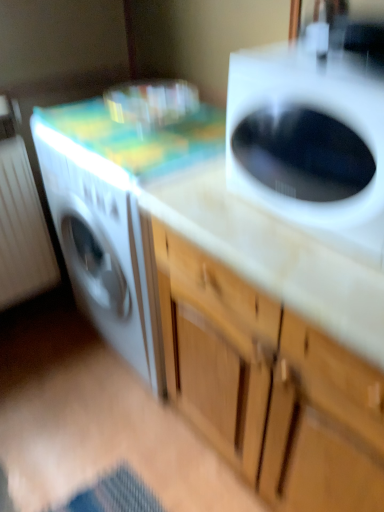
Where is `white glossy washing machine at upper right`? white glossy washing machine at upper right is located at coordinates (310, 141).

Describe the element at coordinates (310, 141) in the screenshot. I see `white glossy washing machine at upper right` at that location.

Measure the distance between point (229, 301) and camera.

Point (229, 301) and camera are 35.51 inches apart from each other.

At what (x,y) coordinates should I click in order to perform the action: click on wooden cabinet at center. Please return your answer as a coordinate pair (x, y). This screenshot has height=512, width=384. Looking at the image, I should click on (269, 386).

The width and height of the screenshot is (384, 512). Describe the element at coordinates (269, 386) in the screenshot. I see `wooden cabinet at center` at that location.

You are a GUI agent. You are given a task and a screenshot of the screen. Output one action in this format:
    pyautogui.click(x=<x>, y=<y>)
    Task: Click on the white glossy washing machine at upper right
    
    Given the screenshot: What is the action you would take?
    pyautogui.click(x=310, y=141)

Which object is positioned more to the right, wooden cabinet at center or white glossy washing machine at upper right?

wooden cabinet at center.

Which object is closer to the camera taking this photo, wooden cabinet at center or white glossy washing machine at upper right?

wooden cabinet at center.

Does point (272, 346) lie in front of point (276, 212)?

That is True.

From the image's perspective, would you say wooden cabinet at center is shown under white glossy washing machine at upper right?

Yes, from the image's perspective, wooden cabinet at center is below white glossy washing machine at upper right.

From a real-world perspective, which object rests below the other?

wooden cabinet at center is physically lower.

Does wooden cabinet at center have a lesser width compared to white glossy washing machine at upper right?

Incorrect, the width of wooden cabinet at center is not less than that of white glossy washing machine at upper right.

Between wooden cabinet at center and white glossy washing machine at upper right, which one has more height?

Standing taller between the two is wooden cabinet at center.

Considering the relative sizes of wooden cabinet at center and white glossy washing machine at upper right in the image provided, is wooden cabinet at center bigger than white glossy washing machine at upper right?

Yes, wooden cabinet at center is bigger than white glossy washing machine at upper right.

Is wooden cabinet at center not within white glossy washing machine at upper right?

Yes.

Is wooden cabinet at center touching white glossy washing machine at upper right?

There is a gap between wooden cabinet at center and white glossy washing machine at upper right.

Is wooden cabinet at center looking in the opposite direction of white glossy washing machine at upper right?

No, white glossy washing machine at upper right is not at the back of wooden cabinet at center.

Consider the image. How many degrees apart are the facing directions of wooden cabinet at center and white glossy washing machine at upper right?

0.223 degrees.

This screenshot has width=384, height=512. What are the coordinates of `washing machine that is above the wooden cabinet at center (from the image's perspective)` in the screenshot? It's located at (310, 141).

Can you confirm if white glossy washing machine at upper right is positioned to the right of wooden cabinet at center?

Incorrect, white glossy washing machine at upper right is not on the right side of wooden cabinet at center.

Looking at this image, is the position of white glossy washing machine at upper right more distant than that of wooden cabinet at center?

Yes, it is.

Is point (378, 260) farther from camera compared to point (278, 322)?

No.

From the image's perspective, is white glossy washing machine at upper right below wooden cabinet at center?

Incorrect, from the image's perspective, white glossy washing machine at upper right is higher than wooden cabinet at center.

From a real-world perspective, which object stands above the other?

white glossy washing machine at upper right.

Between white glossy washing machine at upper right and wooden cabinet at center, which one has smaller width?

white glossy washing machine at upper right.

Can you confirm if white glossy washing machine at upper right is taller than wooden cabinet at center?

No.

In terms of size, does white glossy washing machine at upper right appear bigger or smaller than wooden cabinet at center?

In the image, white glossy washing machine at upper right appears to be smaller than wooden cabinet at center.

Choose the correct answer: Is white glossy washing machine at upper right inside wooden cabinet at center or outside it?

white glossy washing machine at upper right exists outside the volume of wooden cabinet at center.

Is white glossy washing machine at upper right placed right next to wooden cabinet at center?

No, white glossy washing machine at upper right is not in contact with wooden cabinet at center.

Is white glossy washing machine at upper right oriented away from wooden cabinet at center?

No.

What's the angular difference between white glossy washing machine at upper right and wooden cabinet at center's facing directions?

There is a 0.223-degree angle between the facing directions of white glossy washing machine at upper right and wooden cabinet at center.

Locate an element on the screen. The width and height of the screenshot is (384, 512). washing machine behind the wooden cabinet at center is located at coordinates (310, 141).

Where is `washing machine that is behind the wooden cabinet at center`? The image size is (384, 512). washing machine that is behind the wooden cabinet at center is located at coordinates (310, 141).

Where is `washing machine that is above the wooden cabinet at center (from the image's perspective)`? washing machine that is above the wooden cabinet at center (from the image's perspective) is located at coordinates (310, 141).